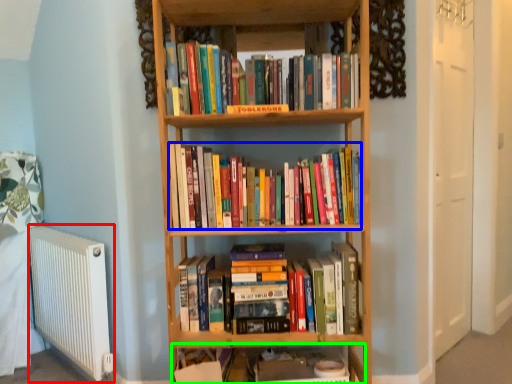
Question: Which is farther away from radiator (highlighted by a red box)? book (highlighted by a blue box) or shelf (highlighted by a green box)?

Choices:
 (A) book
 (B) shelf

Answer: (A)